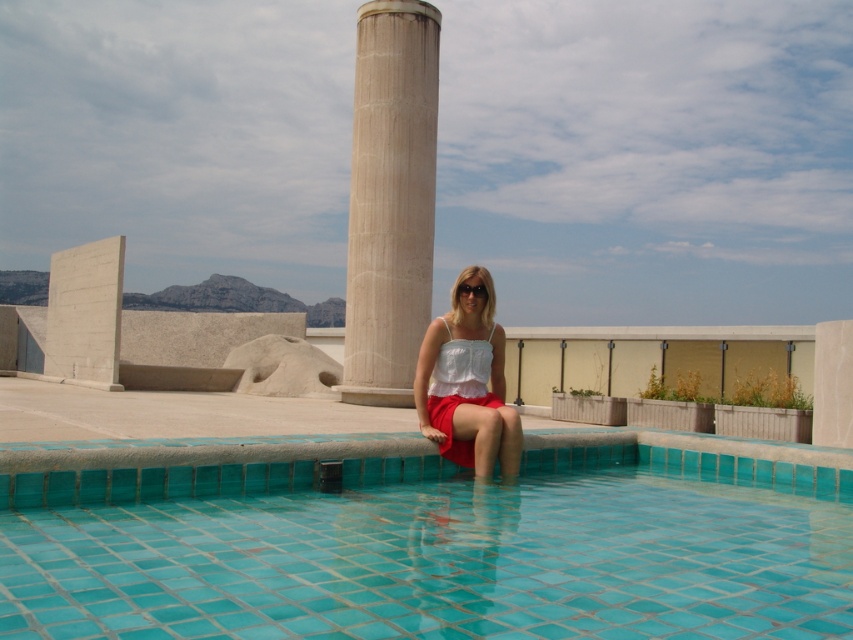
Which of these two, beige marble pillar at center or white satin blouse at center, stands shorter?

white satin blouse at center is shorter.

Does point (352, 218) come farther from viewer compared to point (461, 372)?

That is True.

In order to click on beige marble pillar at center in this screenshot , I will do `click(390, 198)`.

Consider the image. Can you confirm if turquoise tile swimming pool at lower center is positioned to the left of beige marble pillar at center?

No, turquoise tile swimming pool at lower center is not to the left of beige marble pillar at center.

Is the position of turquoise tile swimming pool at lower center less distant than that of beige marble pillar at center?

Yes, it is.

Where is `turquoise tile swimming pool at lower center`? The image size is (853, 640). turquoise tile swimming pool at lower center is located at coordinates (432, 548).

Is white satin blouse at center shorter than matte black sunglasses at center?

Incorrect, white satin blouse at center's height does not fall short of matte black sunglasses at center's.

Measure the distance between white satin blouse at center and camera.

white satin blouse at center and camera are 18.44 feet apart.

Identify the location of white satin blouse at center. This screenshot has height=640, width=853. (467, 385).